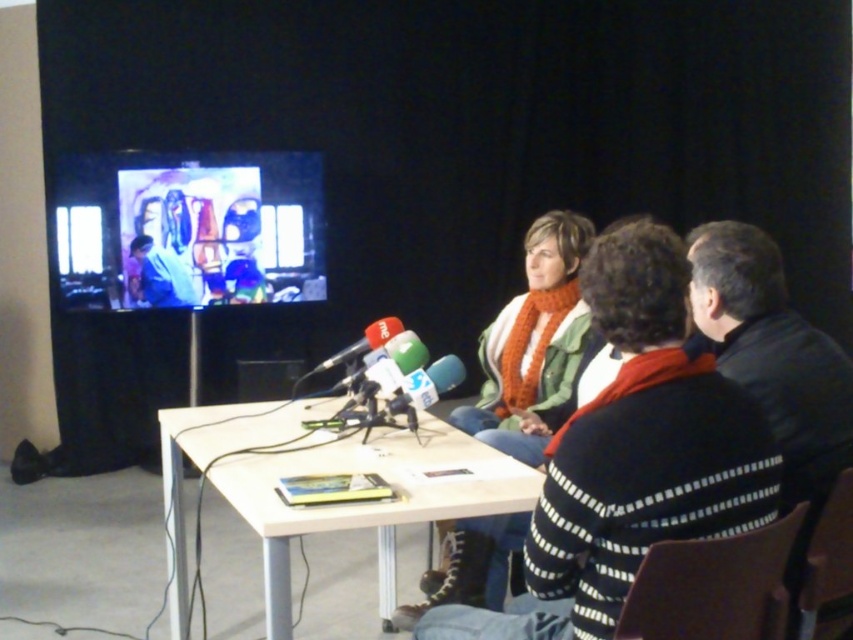
Looking at this image, you are attending a virtual meeting and need to focus on the speaker. The white plastic table at center and the smooth blue shirt at center are both in your view. Which object is closer to the bottom of your screen?

The white plastic table at center is located below the smooth blue shirt at center, so it is closer to the bottom of the screen.

You are a photographer positioned to the right of the setup. You need to capture a photo that includes both the white plastic table at center and the knitted orange scarf at center. Which object should you adjust your position towards to ensure both are in frame?

You should adjust your position towards the white plastic table at center because it is to the left of the knitted orange scarf at center, so moving towards it will help frame both objects properly.

You are a photographer at the event and need to ensure that both the knitted orange scarf at center and the smooth blue shirt at center are visible in your photo. Based on their positions and sizes, which one might require you to adjust your camera angle to capture fully?

The knitted orange scarf at center might be wider than the smooth blue shirt at center, so adjusting the camera angle might be necessary to ensure the scarf is fully captured in the photo.